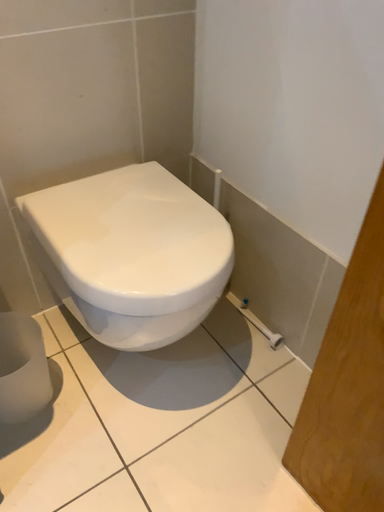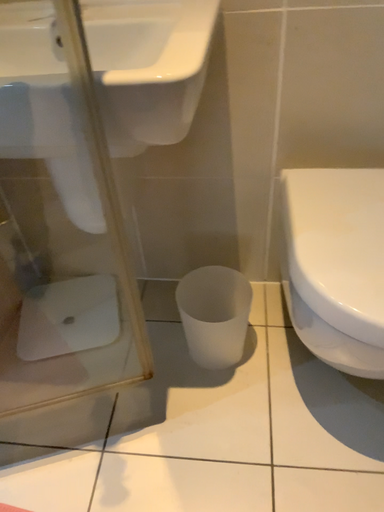
Question: How did the camera likely rotate when shooting the video?

Choices:
 (A) rotated right
 (B) rotated left

Answer: (B)